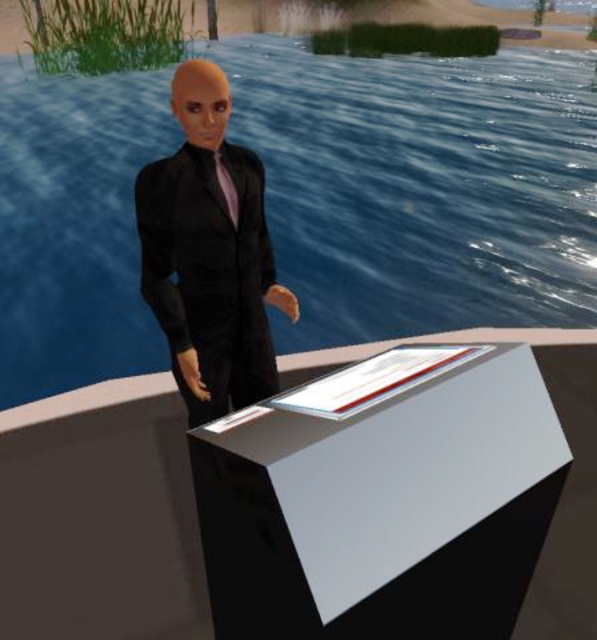
Is blue glossy water at center further to the viewer compared to white glossy table at center?

That is True.

Find the location of a particular element. Image resolution: width=597 pixels, height=640 pixels. blue glossy water at center is located at coordinates (421, 186).

Find the location of a particular element. The height and width of the screenshot is (640, 597). blue glossy water at center is located at coordinates (421, 186).

The width and height of the screenshot is (597, 640). Find the location of `blue glossy water at center`. blue glossy water at center is located at coordinates (421, 186).

Who is more distant from viewer, [556,148] or [174,112]?

Positioned behind is point [556,148].

Locate an element on the screen. Image resolution: width=597 pixels, height=640 pixels. blue glossy water at center is located at coordinates (421, 186).

Between white glossy table at center and matte black tie at center, which one has more height?

Standing taller between the two is white glossy table at center.

Can you confirm if white glossy table at center is thinner than matte black tie at center?

In fact, white glossy table at center might be wider than matte black tie at center.

Which is in front, point (593, 410) or point (238, 204)?

Point (238, 204) is in front.

The height and width of the screenshot is (640, 597). Identify the location of white glossy table at center. (293, 545).